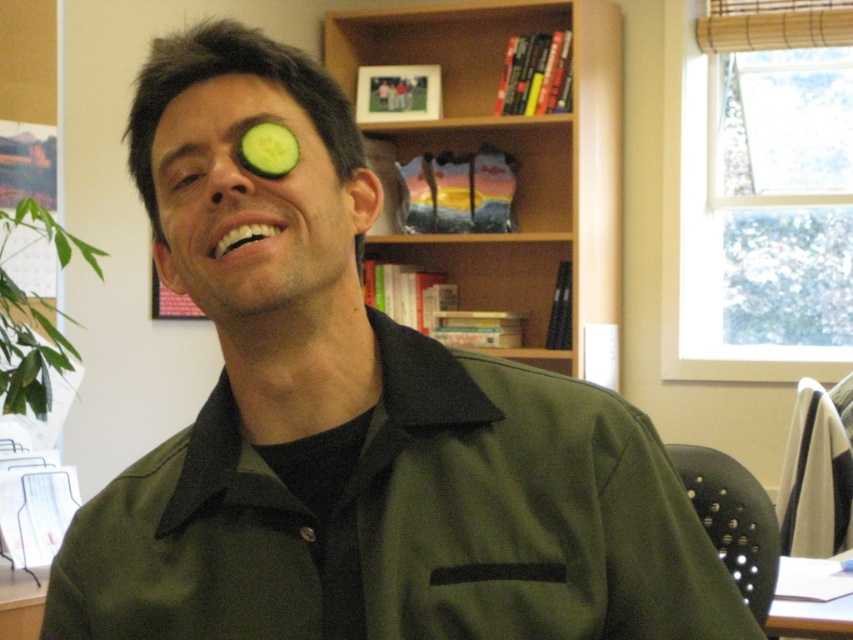
Is the position of green matte cucumber at upper left less distant than that of green matte cucumber at left?

Yes, green matte cucumber at upper left is closer to the viewer.

Does point (242, 84) lie behind point (248, 145)?

Yes, point (242, 84) is farther from viewer.

Image resolution: width=853 pixels, height=640 pixels. Identify the location of green matte cucumber at upper left. (250, 205).

Is wooden bookshelf at upper center in front of green matte cucumber at upper left?

No, it is behind green matte cucumber at upper left.

Does wooden bookshelf at upper center have a greater height compared to green matte cucumber at upper left?

Correct, wooden bookshelf at upper center is much taller as green matte cucumber at upper left.

The height and width of the screenshot is (640, 853). I want to click on wooden bookshelf at upper center, so click(512, 152).

At what (x,y) coordinates should I click in order to perform the action: click on wooden bookshelf at upper center. Please return your answer as a coordinate pair (x, y). Looking at the image, I should click on (512, 152).

Between green matte cucumber at left and green smooth cucumber at left, which one is positioned higher?

green matte cucumber at left

Who is positioned more to the right, green matte cucumber at left or green smooth cucumber at left?

From the viewer's perspective, green matte cucumber at left appears more on the right side.

Identify the location of green matte cucumber at left. (268, 150).